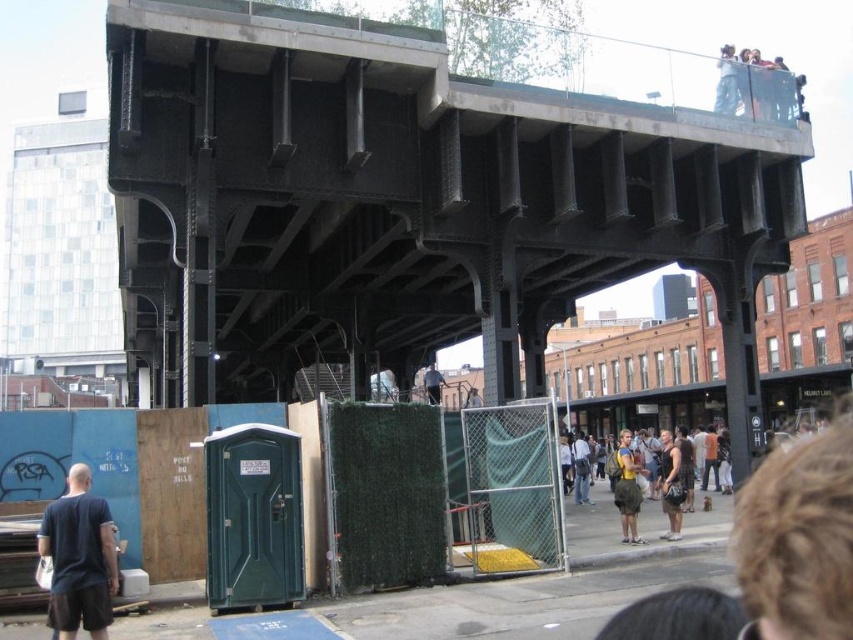
Which of these two, dark blue t-shirt at lower left or dark gray fabric jacket at center, stands taller?

Standing taller between the two is dark gray fabric jacket at center.

From the picture: Does dark blue t-shirt at lower left have a lesser width compared to dark gray fabric jacket at center?

Yes, dark blue t-shirt at lower left is thinner than dark gray fabric jacket at center.

Between point (68, 506) and point (430, 388), which one is positioned in front?

Point (68, 506) is in front.

The width and height of the screenshot is (853, 640). Find the location of `dark blue t-shirt at lower left`. dark blue t-shirt at lower left is located at coordinates (79, 557).

Is black steel bridge at upper center above dark gray fabric jacket at center?

Correct, black steel bridge at upper center is located above dark gray fabric jacket at center.

Can you confirm if black steel bridge at upper center is positioned below dark gray fabric jacket at center?

Incorrect, black steel bridge at upper center is not positioned below dark gray fabric jacket at center.

Between point (207, 305) and point (438, 390), which one is positioned behind?

The point (438, 390) is more distant.

Where is `black steel bridge at upper center`? black steel bridge at upper center is located at coordinates (401, 202).

Is black steel bridge at upper center shorter than green fabric skirt at center?

In fact, black steel bridge at upper center may be taller than green fabric skirt at center.

Does point (669, 120) come in front of point (631, 540)?

That is False.

Locate an element on the screen. The image size is (853, 640). black steel bridge at upper center is located at coordinates (401, 202).